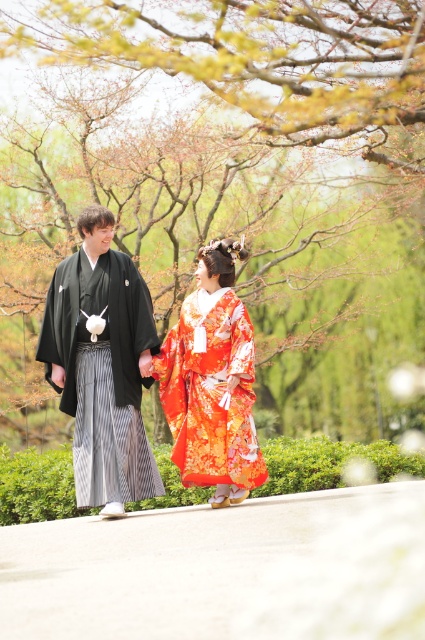
You are an artist trying to paint the scene. You need to decide which kimono to paint first based on their positions. Since the orange floral kimono at center is taller than the black silk kimono at left, which kimono should you paint first to ensure proper layering?

The orange floral kimono at center should be painted first because it is taller than the black silk kimono at left, allowing you to layer the shorter kimono over it if needed.

You are a photographer trying to capture a closeup of the two points in the scene. Which point, point (144,483) or point (249,392), is closer to your camera?

Point (144,483) is closer to the camera than point (249,392).